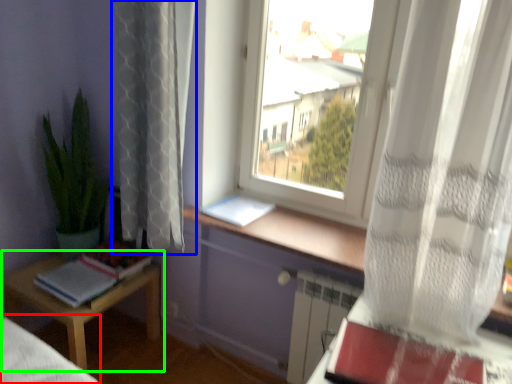
Question: Which object is the farthest from bed frame (highlighted by a red box)? Choose among these: curtain (highlighted by a blue box) or table (highlighted by a green box).

Choices:
 (A) curtain
 (B) table

Answer: (A)